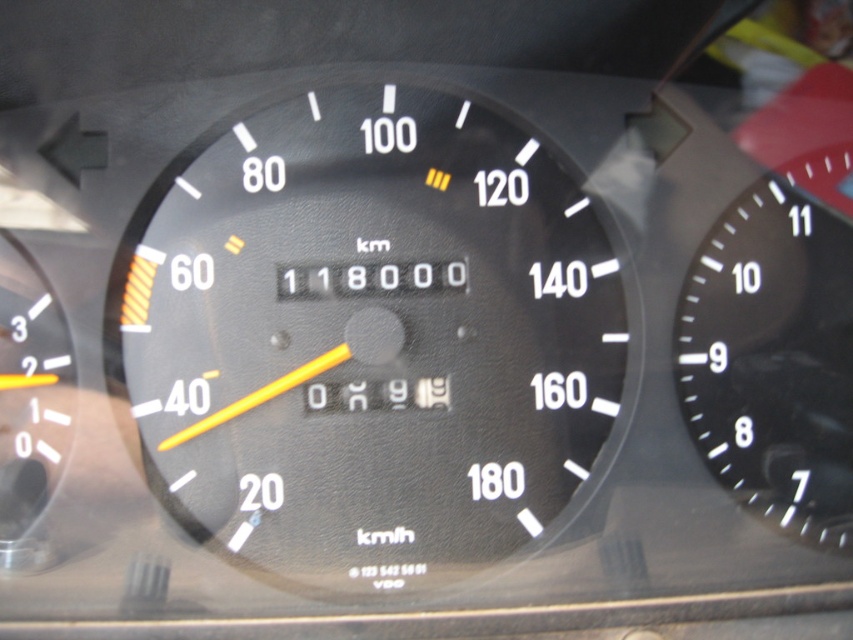
Is point (196, 458) in front of point (695, 296)?

That is True.

Looking at this image, who is higher up, black matte speedometer at center or black matte speedometer at right?

Positioned higher is black matte speedometer at center.

At what (x,y) coordinates should I click in order to perform the action: click on black matte speedometer at center. Please return your answer as a coordinate pair (x, y). This screenshot has height=640, width=853. Looking at the image, I should click on (367, 333).

Find the location of a particular element. black matte speedometer at center is located at coordinates [367, 333].